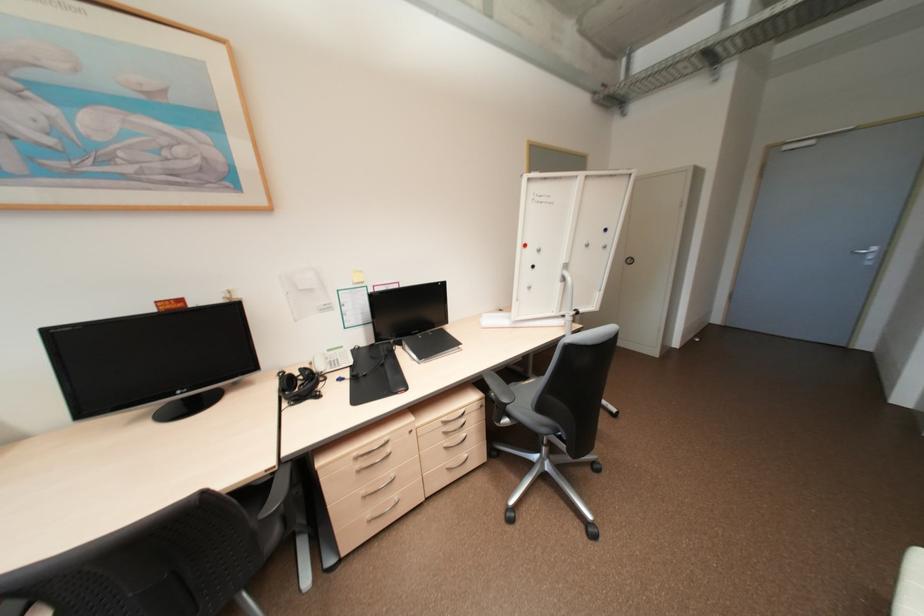
The width and height of the screenshot is (924, 616). What are the coordinates of `chair armrest` in the screenshot? It's located at (499, 389).